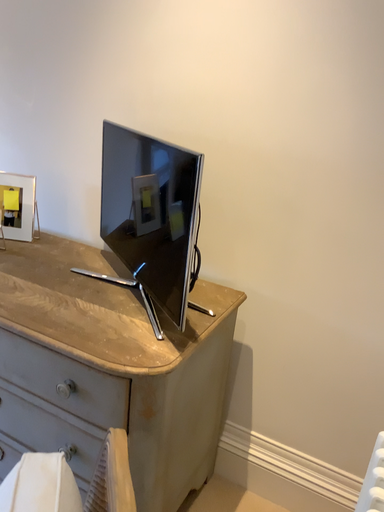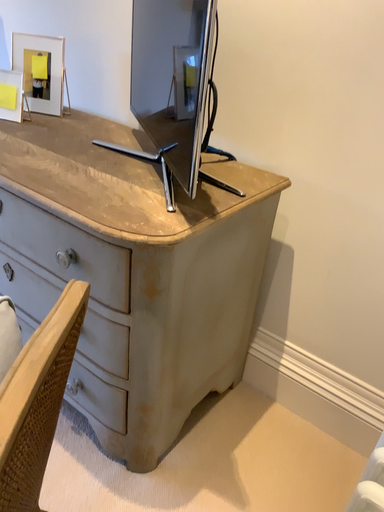
Question: How did the camera likely rotate when shooting the video?

Choices:
 (A) rotated left
 (B) rotated right

Answer: (A)